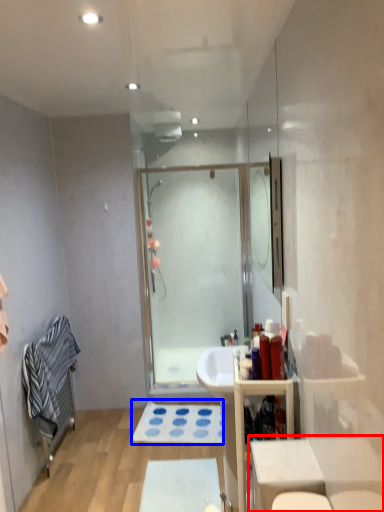
Question: Which of the following is the closest to the observer, table (highlighted by a red box) or bath mat (highlighted by a blue box)?

Choices:
 (A) table
 (B) bath mat

Answer: (A)